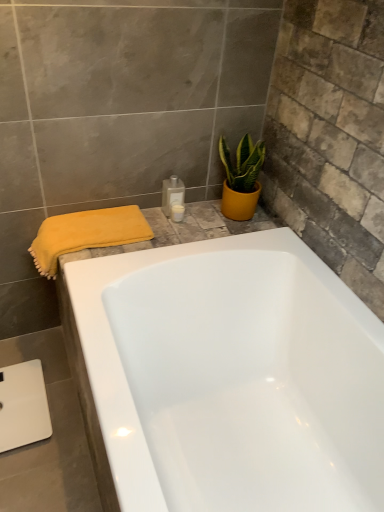
At what (x,y) coordinates should I click in order to perform the action: click on free area in between yellow matte pot at upper right and white glossy bottle at upper center, acting as the 2th toiletry starting from the top. Please return your answer as a coordinate pair (x, y). The image size is (384, 512). Looking at the image, I should click on (203, 219).